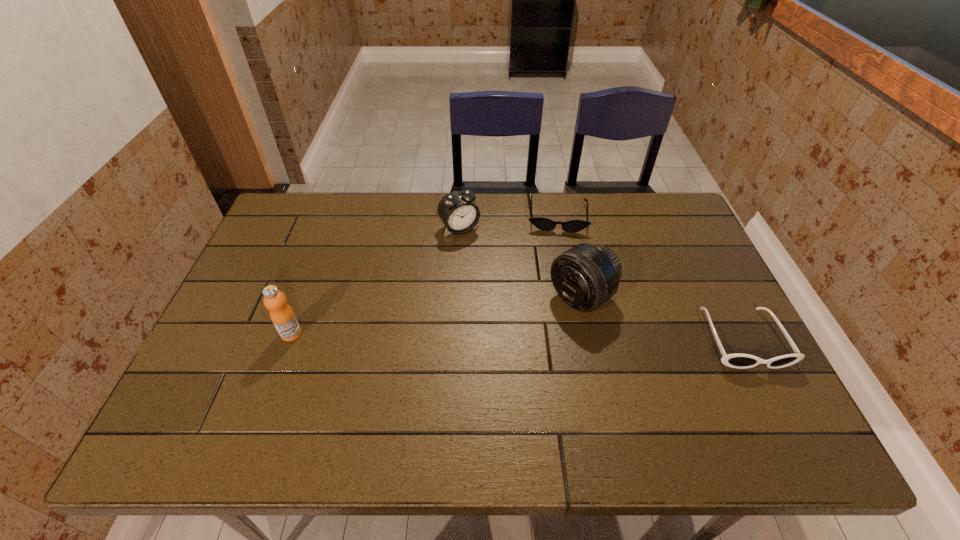
Locate an element on the screen. This screenshot has height=540, width=960. free spot on the desktop that is between the leftmost object and the rightmost object and is positioned on the front side of the second object from left to right is located at coordinates (542, 336).

I want to click on free space on the desktop that is between the leftmost object and the nearer sunglasses and is positioned on the front-facing side of the left sunglasses, so click(559, 336).

This screenshot has width=960, height=540. I want to click on free space on the desktop that is between the orange juice and the rightmost object and is positioned on the front-facing side of the telephoto lens, so click(x=527, y=336).